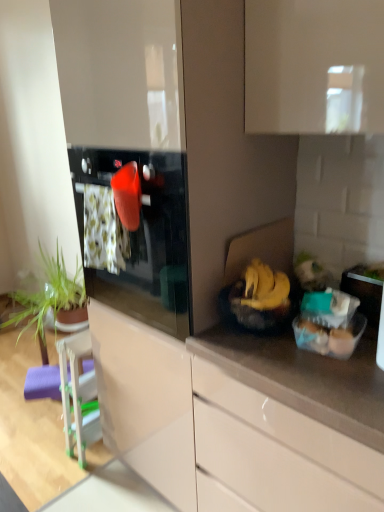
Question: Would you say glossy white cabinet at lower center is inside or outside yellow matte bananas at right?

Choices:
 (A) inside
 (B) outside

Answer: (B)

Question: In terms of height, does glossy white cabinet at lower center look taller or shorter compared to yellow matte bananas at right?

Choices:
 (A) short
 (B) tall

Answer: (B)

Question: Estimate the real-world distances between objects in this image. Which object is closer to the purple foam bar stool at lower left?

Choices:
 (A) white glossy chair at lower left, which appears as the second appliance when viewed from the top
 (B) glossy black oven at center
 (C) translucent plastic eggs at right
 (D) clear plastic container at right, marked as the 1th appliance in a right-to-left arrangement
 (E) glossy white cabinet at lower center

Answer: (A)

Question: Which object is positioned farthest from the clear plastic container at right, arranged as the first appliance when viewed from the top?

Choices:
 (A) glossy white cabinet at lower center
 (B) purple foam bar stool at lower left
 (C) white glossy chair at lower left, arranged as the first appliance when ordered from the bottom
 (D) glossy black oven at center
 (E) green leafy plant at left

Answer: (B)